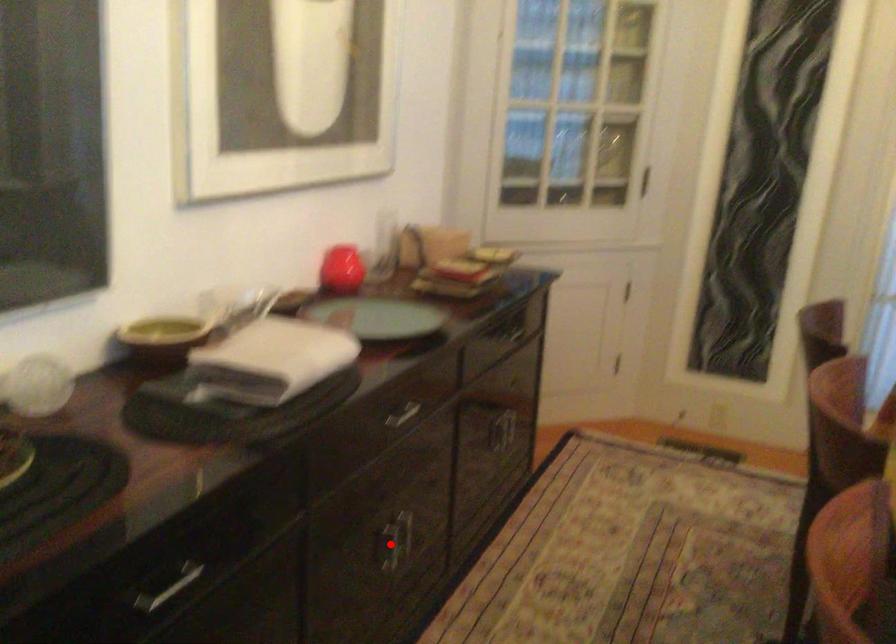
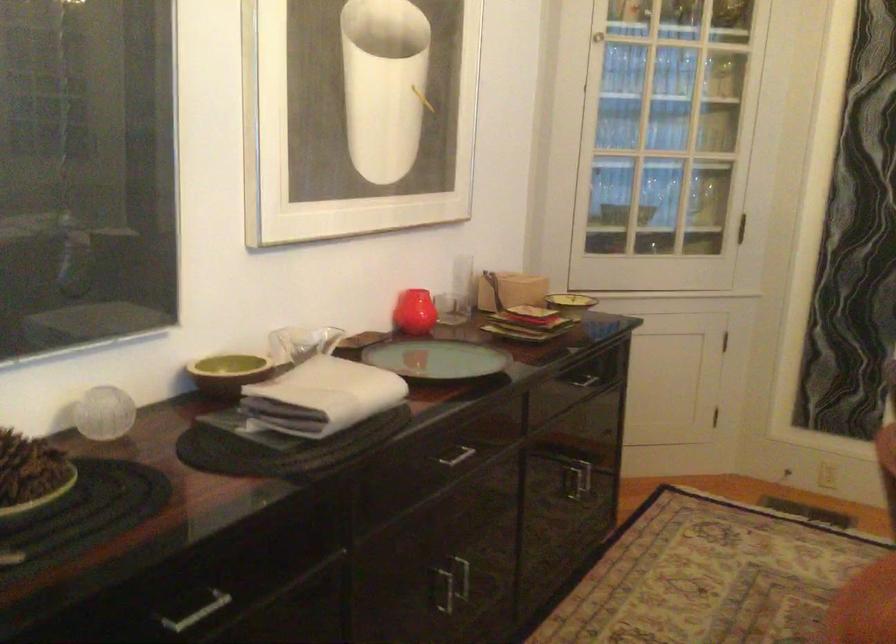
Where in the second image is the point corresponding to the highlighted location from the first image?

(443, 589)